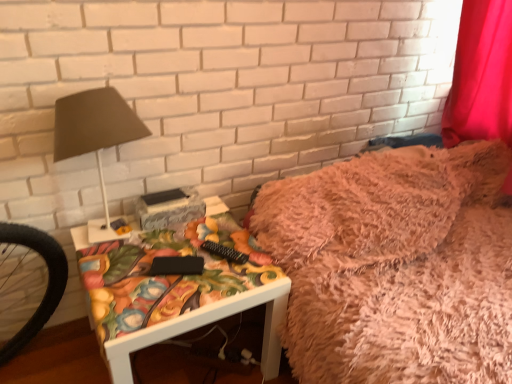
The width and height of the screenshot is (512, 384). Find the location of `free space above matte floral-patterned side table at center (from a real-world perspective)`. free space above matte floral-patterned side table at center (from a real-world perspective) is located at coordinates (170, 254).